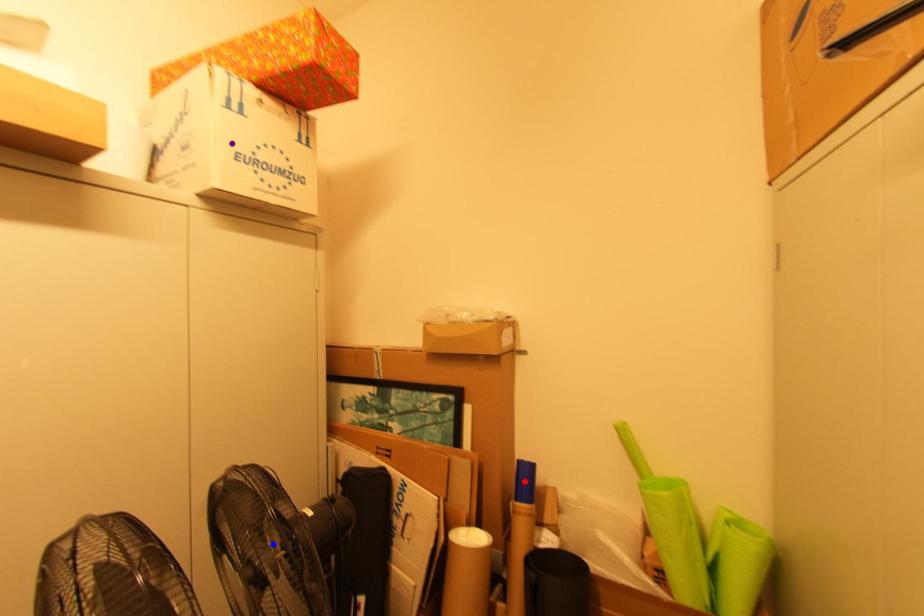
Order these from nearest to farthest:
A) purple point
B) red point
C) blue point

red point, purple point, blue point